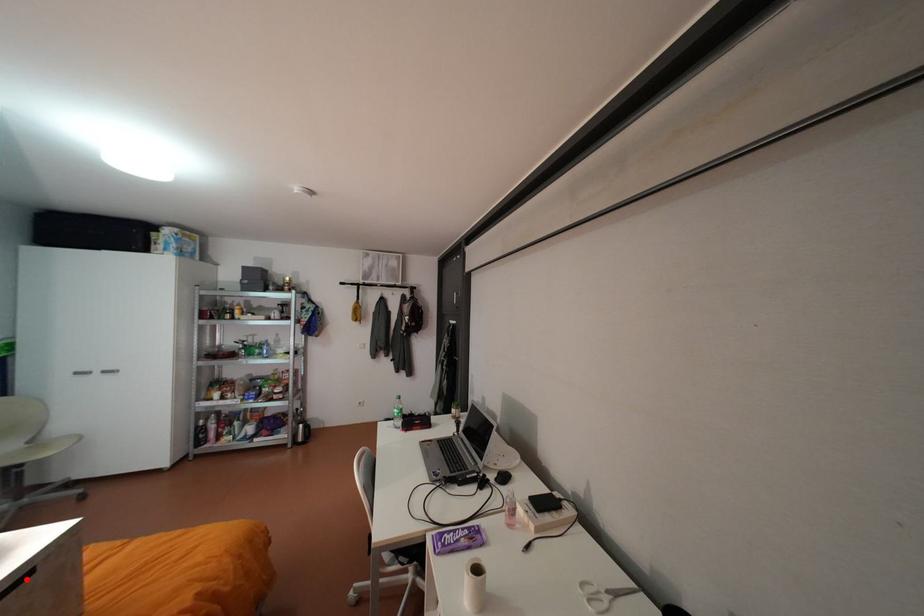
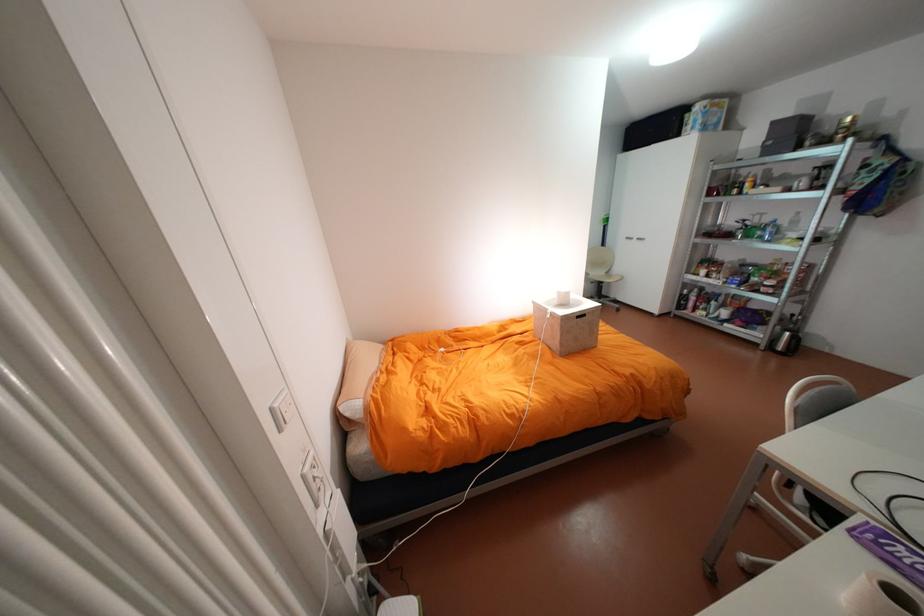
Question: A red point is marked in image1. In image2, is the corresponding 3D point closer to the camera or farther? Reply with the corresponding letter.

Choices:
 (A) The corresponding 3D point is closer.
 (B) The corresponding 3D point is farther.

Answer: (B)